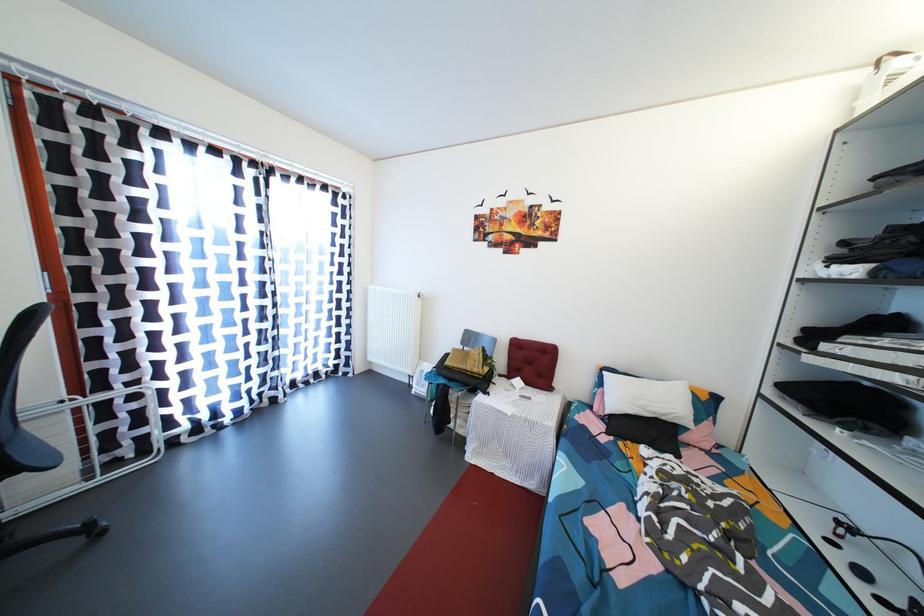
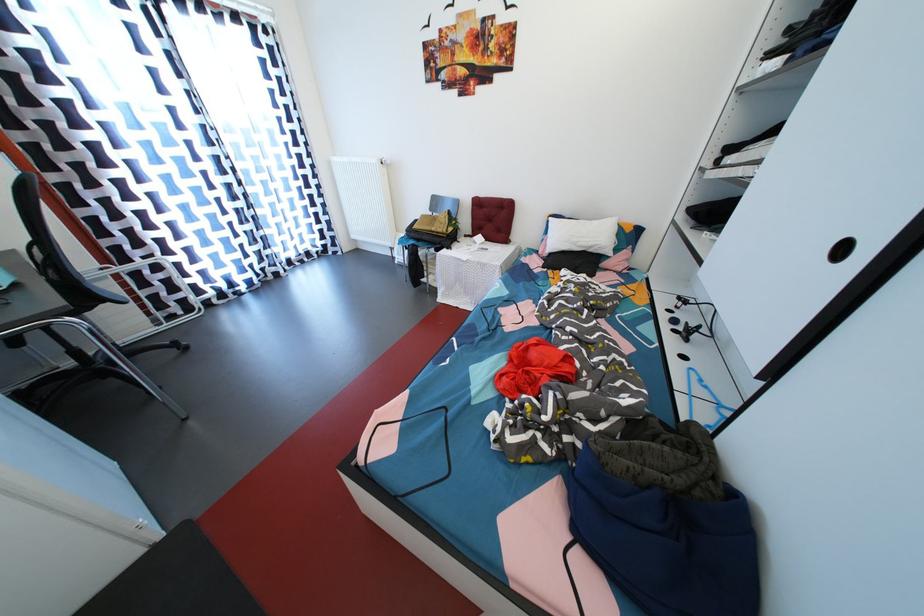
Question: I am providing you with two images of the same scene from different viewpoints. After the viewpoint changes to image2, which objects are now occluded?

Choices:
 (A) recessed cabinet handle
 (B) black game controller
 (C) white bed pillow
 (D) none of these

Answer: (D)